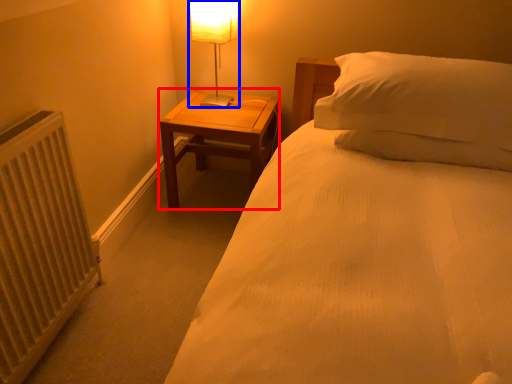
Question: Which object is further to the camera taking this photo, nightstand (highlighted by a red box) or table lamp (highlighted by a blue box)?

Choices:
 (A) nightstand
 (B) table lamp

Answer: (A)